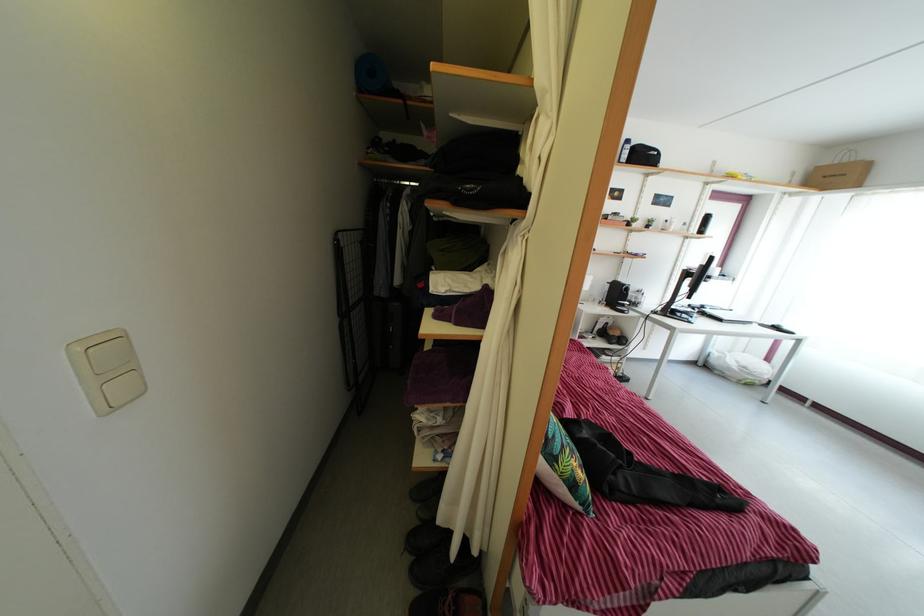
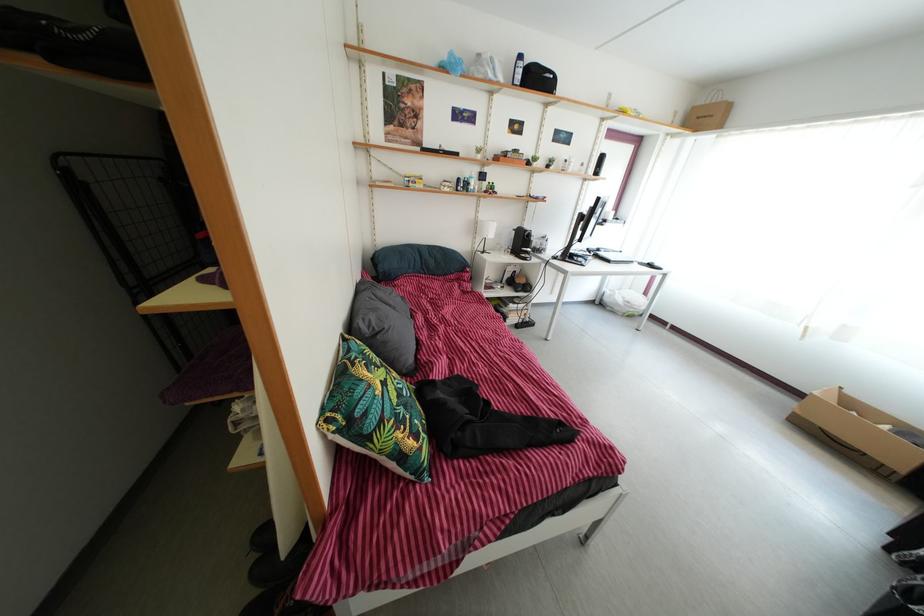
Question: The first image is from the beginning of the video and the second image is from the end. How did the camera likely rotate when shooting the video?

Choices:
 (A) Left
 (B) Right
 (C) Up
 (D) Down

Answer: (B)